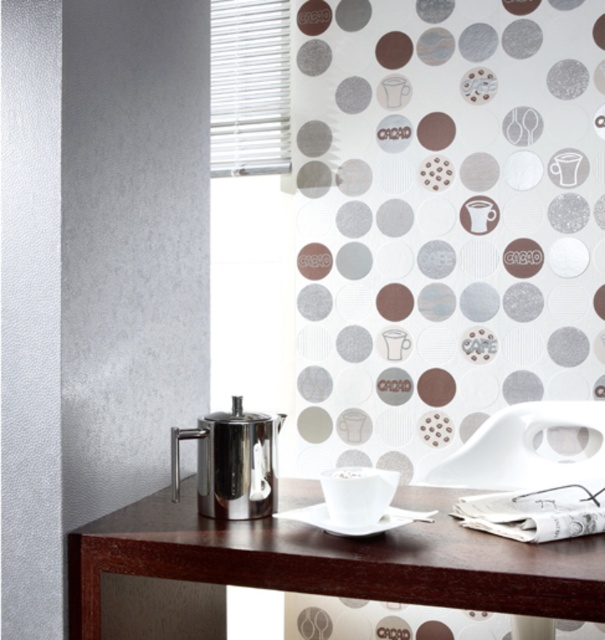
You are a small robot with a 5 inch wide arm. You need to reach the polished stainless steel teapot at left from the shiny dark wood table at center to pick it up. Can your arm fit between them?

The distance between the shiny dark wood table at center and the polished stainless steel teapot at left is 6.65 inches. Since your arm is 5 inches wide, it can fit between them as 5 inches is less than 6.65 inches.